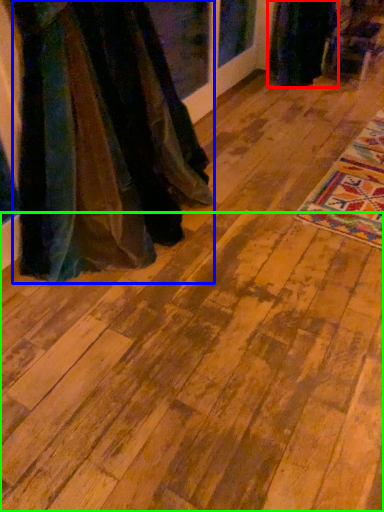
Question: Which object is the closest to the fancy dress (highlighted by a red box)? Choose among these: fancy dress (highlighted by a blue box) or plywood (highlighted by a green box).

Choices:
 (A) fancy dress
 (B) plywood

Answer: (A)